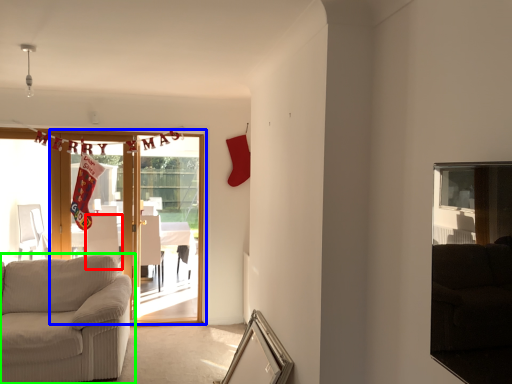
Question: Which object is the closest to the armchair (highlighted by a red box)? Choose among these: door (highlighted by a blue box) or studio couch (highlighted by a green box).

Choices:
 (A) door
 (B) studio couch

Answer: (A)